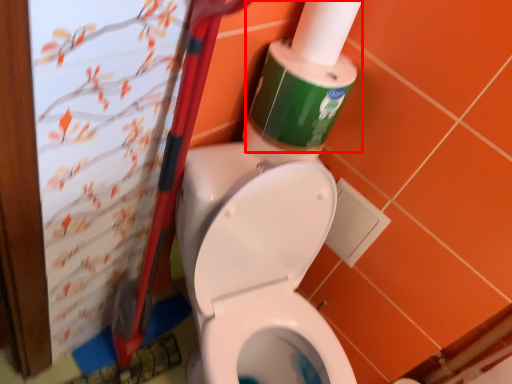
Question: From the image's perspective, considering the relative positions of cleaning product (annotated by the red box) and toilet paper in the image provided, where is cleaning product (annotated by the red box) located with respect to the staircase?

Choices:
 (A) below
 (B) above

Answer: (A)